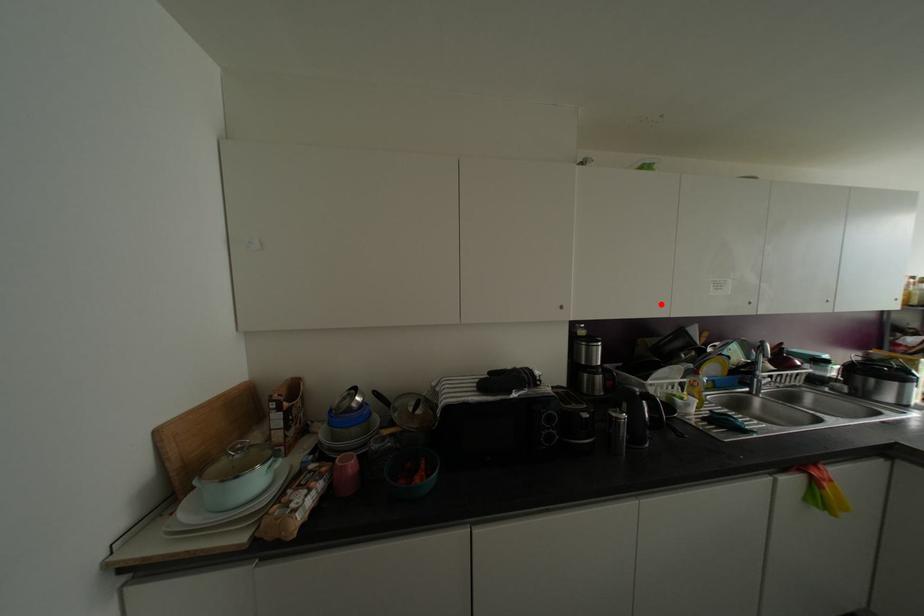
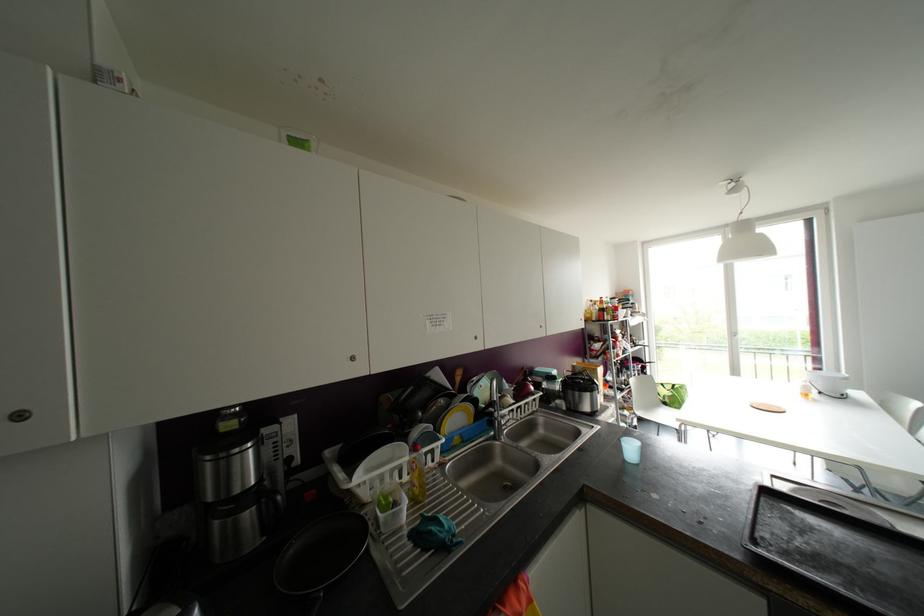
Find the pixel in the second image that matches the highlighted location in the first image.

(351, 358)